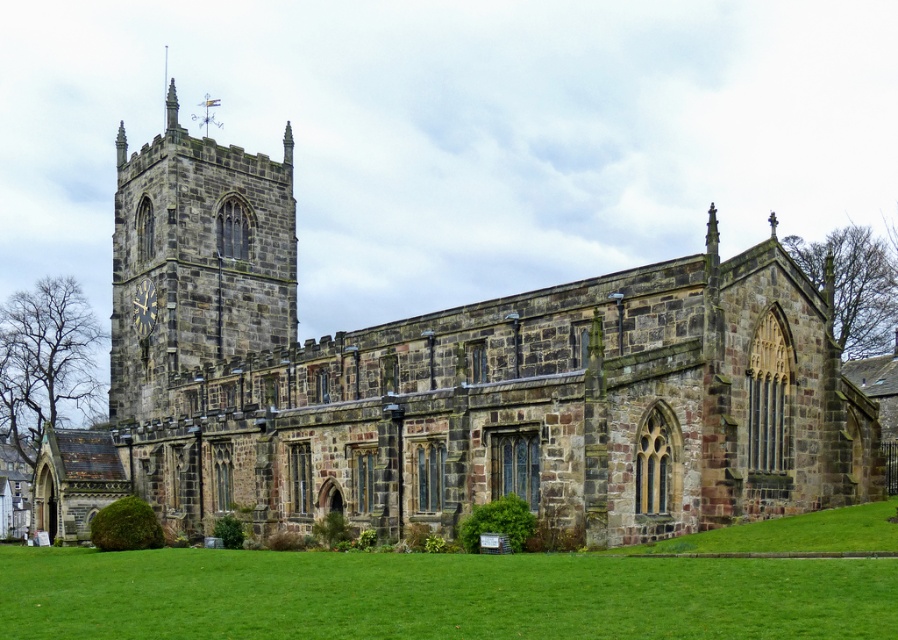
Is stone clock tower at upper left thinner than metallic gold clock at left?

No, stone clock tower at upper left is not thinner than metallic gold clock at left.

Does stone clock tower at upper left have a smaller size compared to metallic gold clock at left?

→ Incorrect, stone clock tower at upper left is not smaller in size than metallic gold clock at left.

The width and height of the screenshot is (898, 640). What do you see at coordinates (197, 260) in the screenshot?
I see `stone clock tower at upper left` at bounding box center [197, 260].

The height and width of the screenshot is (640, 898). I want to click on stone clock tower at upper left, so click(x=197, y=260).